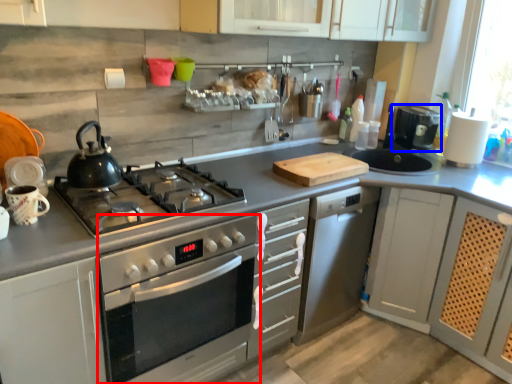
Question: Which object is further to the camera taking this photo, oven (highlighted by a red box) or coffee machine (highlighted by a blue box)?

Choices:
 (A) oven
 (B) coffee machine

Answer: (B)